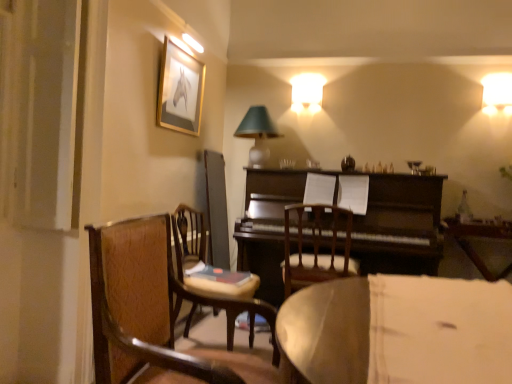
Question: Looking at the image, does matte glass table lamp at upper center seem bigger or smaller compared to wooden chair at center, which is the second chair from back to front?

Choices:
 (A) big
 (B) small

Answer: (B)

Question: From the image's perspective, is matte glass table lamp at upper center located above or below wooden chair at center, which is the second chair from back to front?

Choices:
 (A) above
 (B) below

Answer: (A)

Question: Which of these objects is positioned closest to the wooden chair at center, the 2th chair viewed from the front?

Choices:
 (A) wooden chair at left, the third chair when ordered from back to front
 (B) gold-framed picture at upper left
 (C) wooden chair at center, marked as the 3th chair in a front-to-back arrangement
 (D) dark brown polished wood piano at center
 (E) wooden table at center

Answer: (C)

Question: Based on their relative distances, which object is nearer to the wooden chair at left, the third chair when ordered from back to front?

Choices:
 (A) gold-framed picture at upper left
 (B) matte glass table lamp at upper center
 (C) wooden chair at center, marked as the 3th chair in a front-to-back arrangement
 (D) dark brown polished wood piano at center
 (E) wooden table at center

Answer: (C)